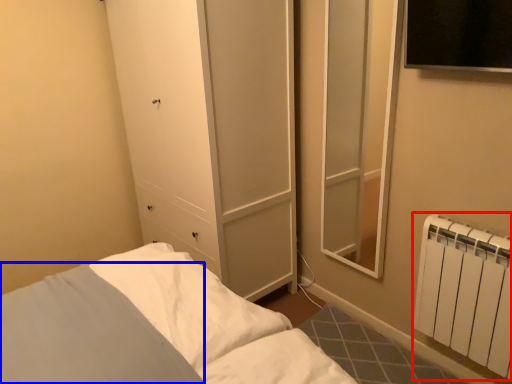
Question: Which object appears closest to the camera in this image, radiator (highlighted by a red box) or pillow (highlighted by a blue box)?

Choices:
 (A) radiator
 (B) pillow

Answer: (B)